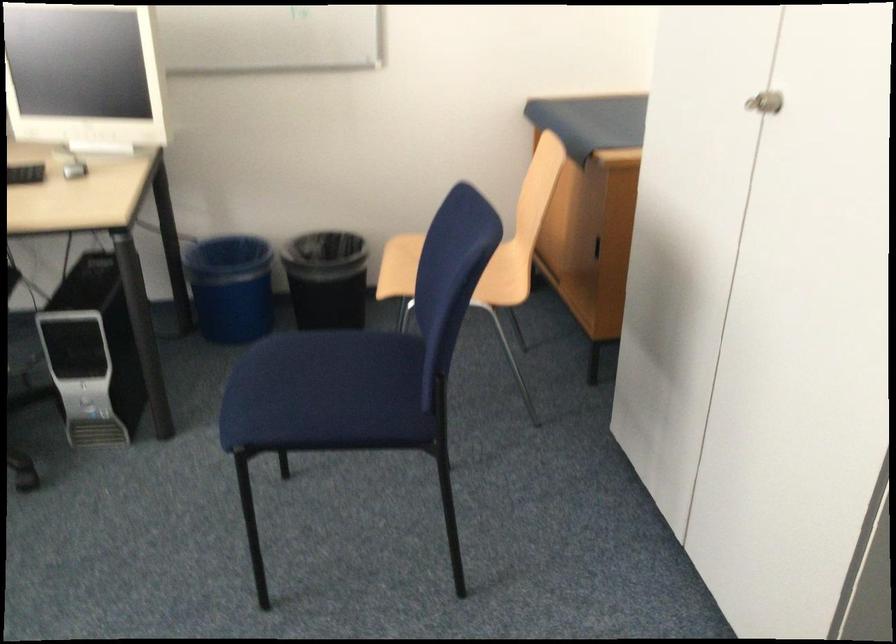
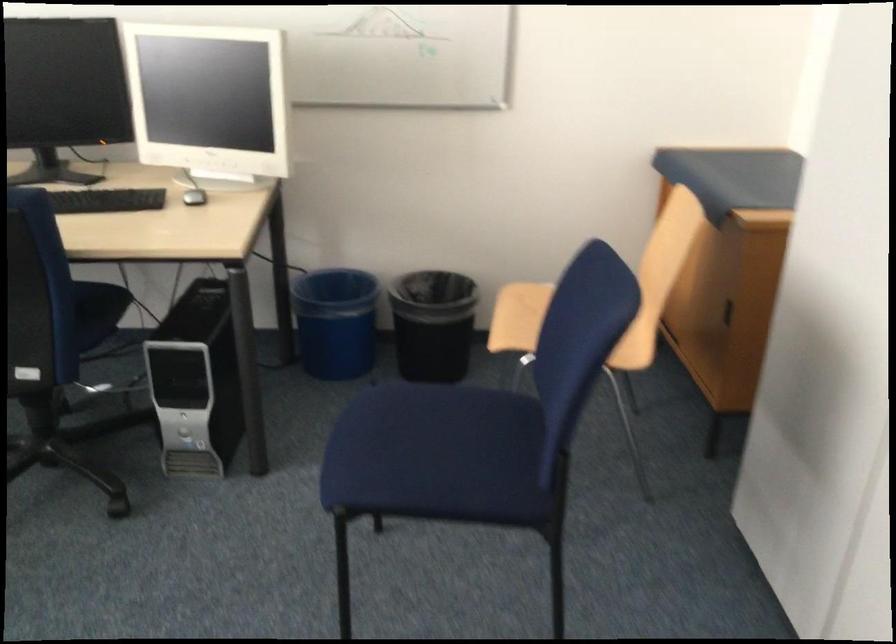
Consider the image. The images are taken continuously from a first-person perspective. In which direction are you moving?

The movement direction of the cameraman is left, forward.